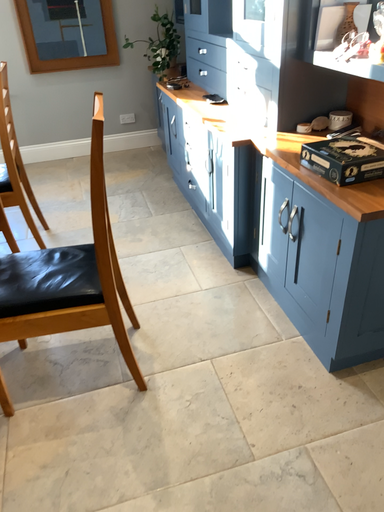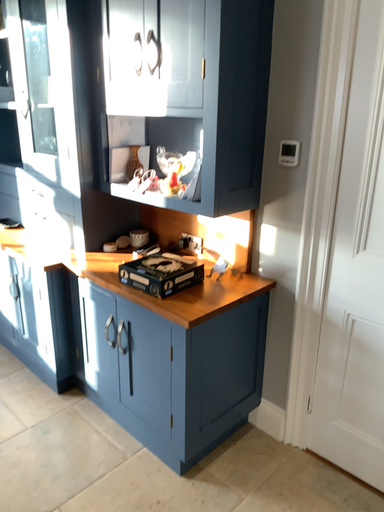
Question: How did the camera likely rotate when shooting the video?

Choices:
 (A) rotated upward
 (B) rotated downward

Answer: (A)